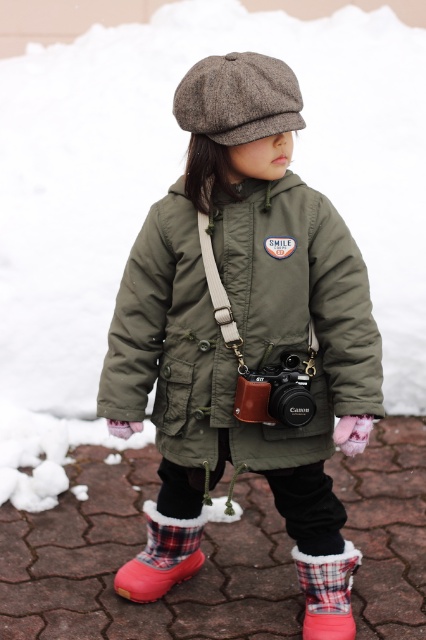
The child is holding a small toy in their hand. If the toy is dropped, will it land closer to the plaid fabric boot at lower center or the matte black camera at center?

The plaid fabric boot at lower center is positioned under the matte black camera at center, so if the toy is dropped, it will land closer to the plaid fabric boot at lower center.

The child is holding a camera and wearing a beret. Where is the brown wool beret at center in relation to the matte black camera at center?

The brown wool beret at center is above the matte black camera at center.

Looking at this image, you are a photographer trying to position two markers on a grid overlay of the image. The markers are placed at point [169,561] and point [307,627]. From the photographer perspective, which marker is closer to the camera?

Point [307,627] is closer to the camera because point [169,561] is behind it.